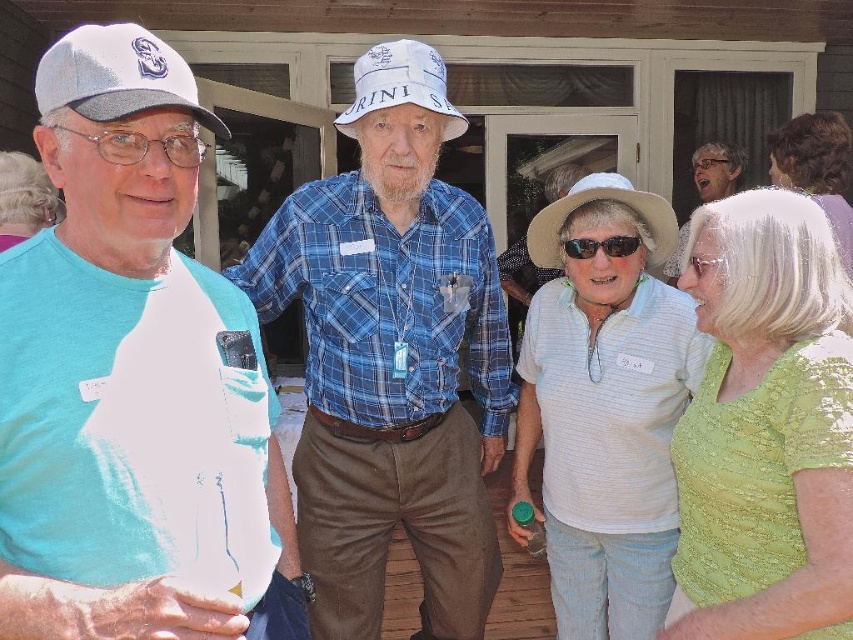
Question: Which of the following is the closest to the observer?

Choices:
 (A) white textured shirt at center
 (B) matte white cap at left
 (C) clear plastic glasses at left

Answer: (B)

Question: Is green sequined blouse at right to the left of white textured shirt at center from the viewer's perspective?

Choices:
 (A) no
 (B) yes

Answer: (A)

Question: Is matte white cap at left to the left of blue plaid shirt at center from the viewer's perspective?

Choices:
 (A) no
 (B) yes

Answer: (B)

Question: Which of the following is the closest to the observer?

Choices:
 (A) (364, 70)
 (B) (775, 138)
 (C) (693, 380)

Answer: (A)

Question: Can you confirm if light brown curly hair at upper right is positioned above white cotton baseball hat at center?

Choices:
 (A) yes
 (B) no

Answer: (B)

Question: Which is farther from the clear plastic glasses at left?

Choices:
 (A) matte blue shirt at center
 (B) white matte baseball hat at upper center
 (C) matte white cap at left

Answer: (A)